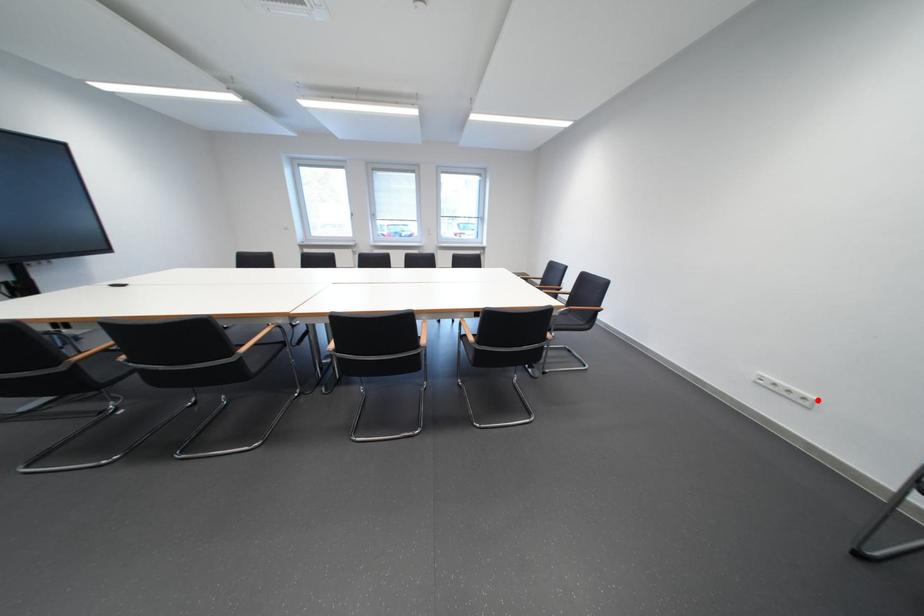
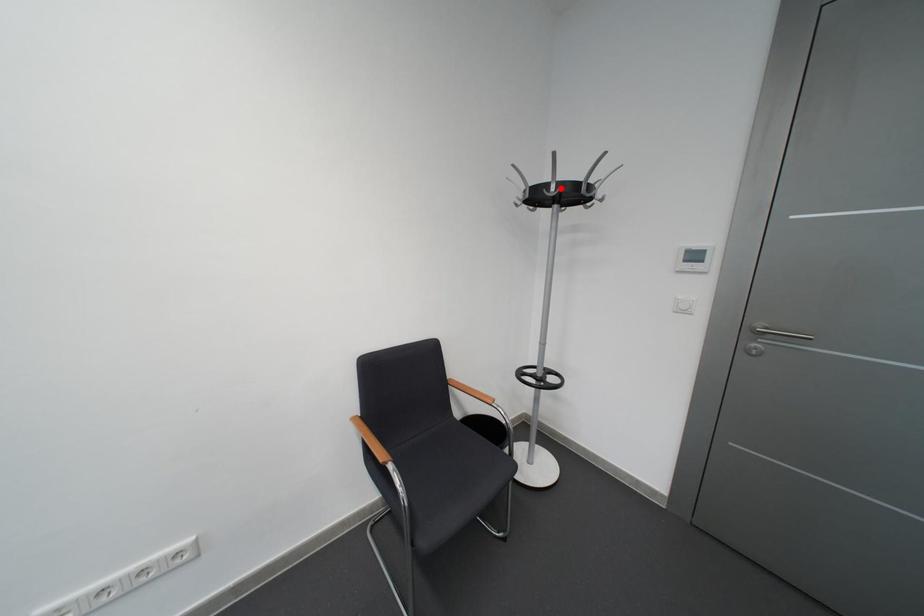
I am providing you with two images of the same scene from different viewpoints. A red point is marked on the first image and another point is marked on the second image. Are the points marked in image1 and image2 representing the same 3D position?

No